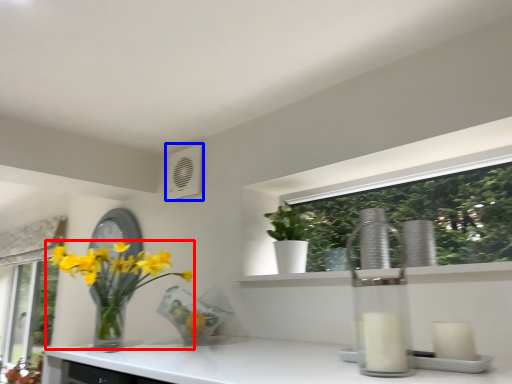
Question: Which point is closer to the camera, houseplant (highlighted by a red box) or air conditioning (highlighted by a blue box)?

Choices:
 (A) houseplant
 (B) air conditioning

Answer: (A)